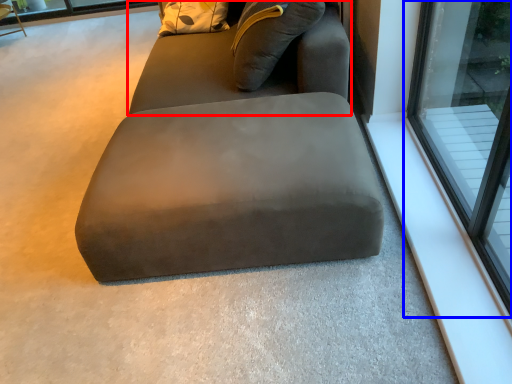
Question: Among these objects, which one is nearest to the camera, bean bag chair (highlighted by a red box) or window (highlighted by a blue box)?

Choices:
 (A) bean bag chair
 (B) window

Answer: (B)